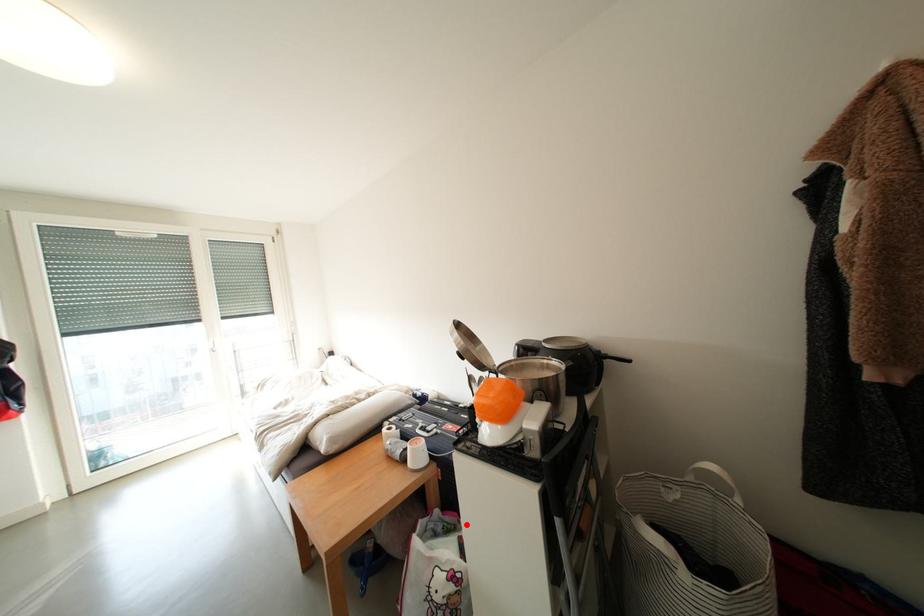
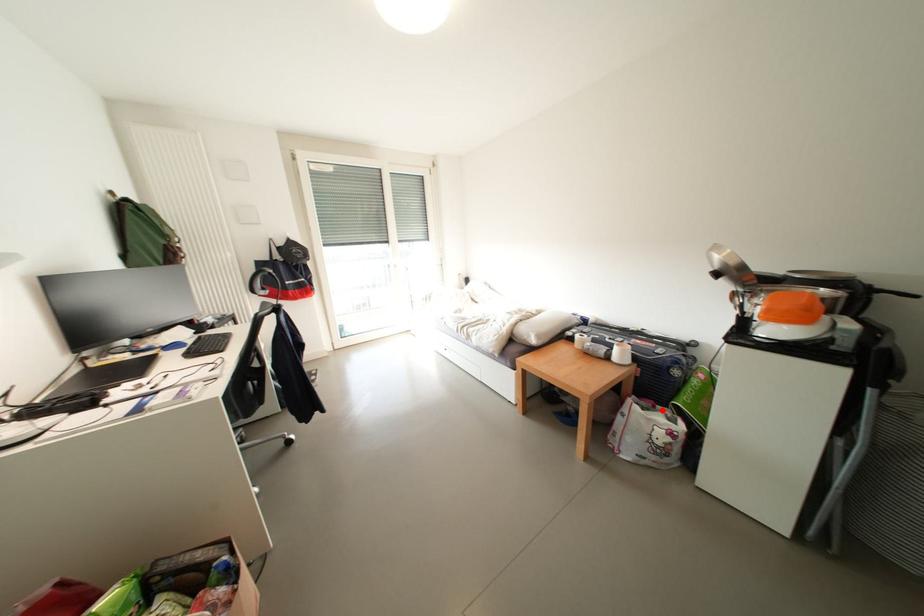
I am providing you with two images of the same scene from different viewpoints. A red point is marked on the first image and another point is marked on the second image. Is the red point in image1 aligned with the point shown in image2?

Yes